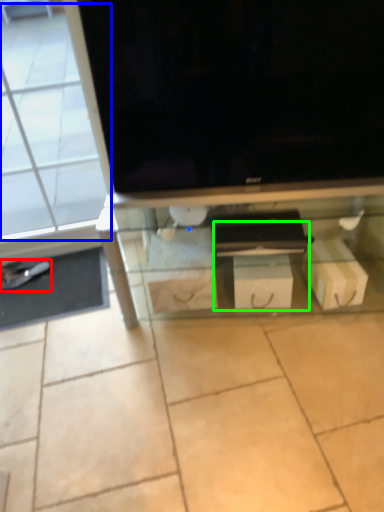
Question: Which object is the closest to the footwear (highlighted by a red box)? Choose among these: glass door (highlighted by a blue box) or drawer (highlighted by a green box).

Choices:
 (A) glass door
 (B) drawer

Answer: (A)